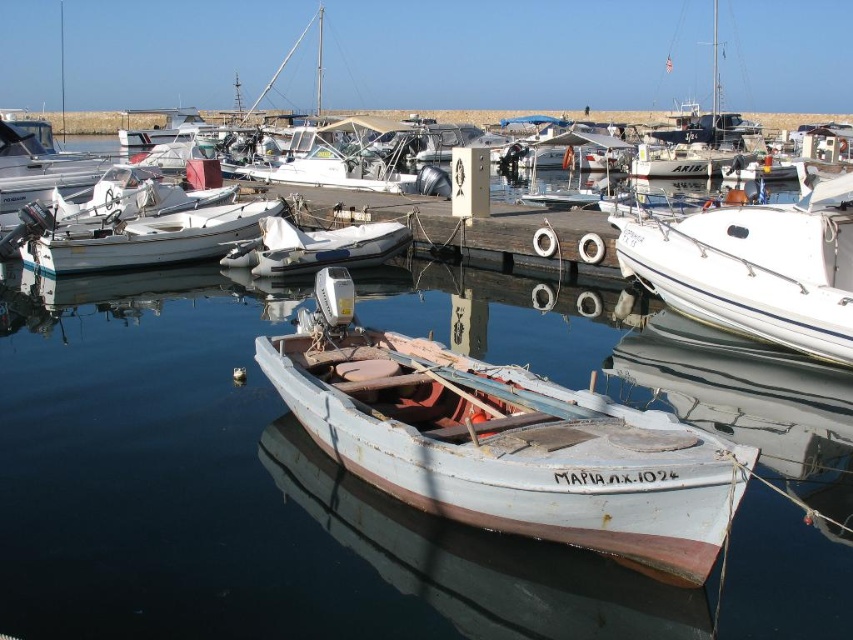
Between point (376, 381) and point (184, 244), which one is positioned in front?

Positioned in front is point (376, 381).

Between white weathered boat at center and white matte boat at center, which one has less height?

white matte boat at center is shorter.

Between point (578, 392) and point (146, 252), which one is positioned in front?

Positioned in front is point (578, 392).

This screenshot has height=640, width=853. What are the coordinates of `white weathered boat at center` in the screenshot? It's located at (505, 442).

Which of these two, white glossy boat at right or white rubber dinghy at center, stands taller?

white glossy boat at right

Is white glossy boat at right thinner than white rubber dinghy at center?

A: Yes, white glossy boat at right is thinner than white rubber dinghy at center.

At what (x,y) coordinates should I click in order to perform the action: click on white glossy boat at right. Please return your answer as a coordinate pair (x, y). This screenshot has height=640, width=853. Looking at the image, I should click on (756, 268).

How distant is white weathered boat at center from white rubber dinghy at center?

A distance of 22.68 feet exists between white weathered boat at center and white rubber dinghy at center.

Which is in front, point (519, 458) or point (271, 220)?

Positioned in front is point (519, 458).

This screenshot has height=640, width=853. I want to click on white weathered boat at center, so click(505, 442).

I want to click on white weathered boat at center, so click(505, 442).